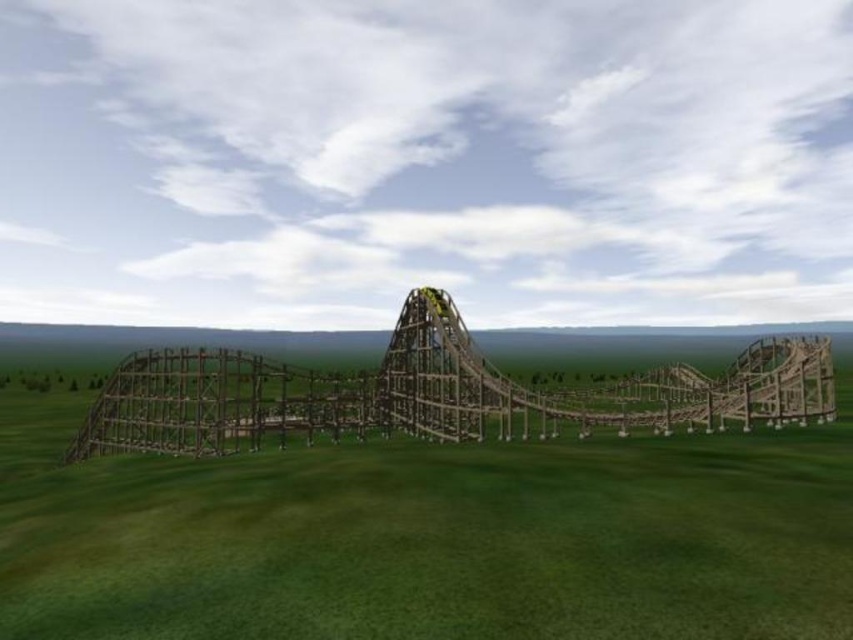
Question: Can you confirm if green grassy at center is positioned above brown wooden roller coaster at center?

Choices:
 (A) no
 (B) yes

Answer: (B)

Question: Which point appears farthest from the camera in this image?

Choices:
 (A) (187, 481)
 (B) (767, 376)

Answer: (B)

Question: Which point appears closest to the camera in this image?

Choices:
 (A) (126, 364)
 (B) (198, 488)

Answer: (B)

Question: Is green grassy at center positioned in front of brown wooden roller coaster at center?

Choices:
 (A) no
 (B) yes

Answer: (B)

Question: Which object appears closest to the camera in this image?

Choices:
 (A) brown wooden roller coaster at center
 (B) green grassy at center

Answer: (B)

Question: Is green grassy at center to the left of brown wooden roller coaster at center from the viewer's perspective?

Choices:
 (A) no
 (B) yes

Answer: (A)